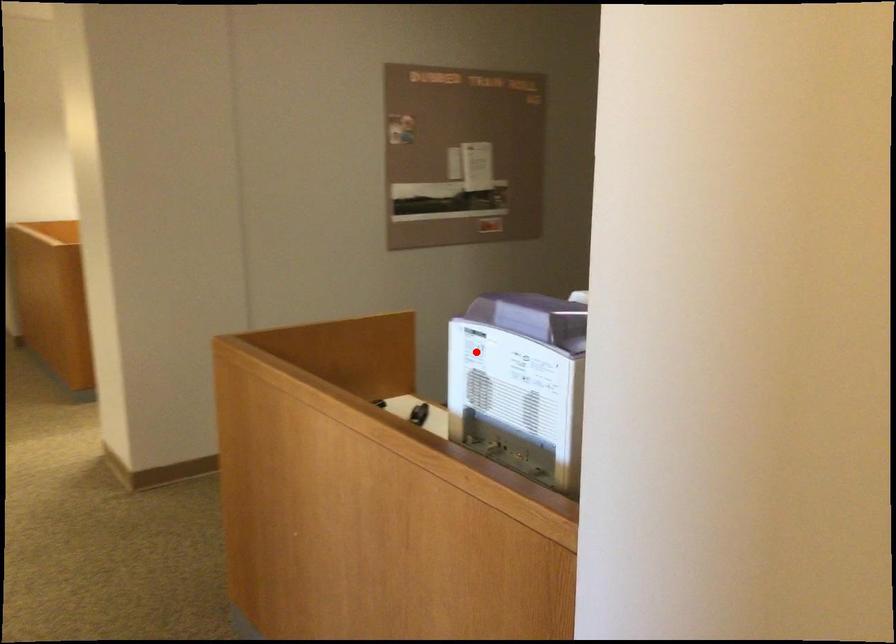
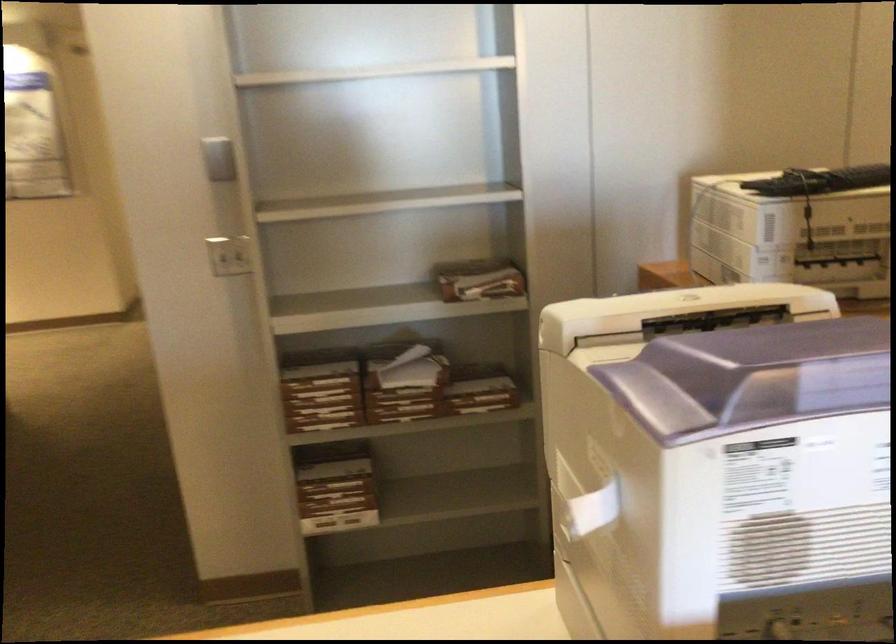
In the second image, find the point that corresponds to the highlighted location in the first image.

(592, 507)